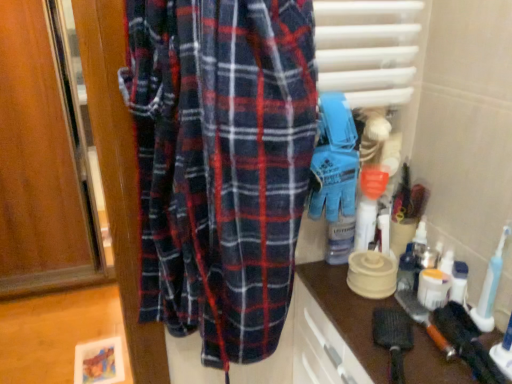
Locate an element on the screen. free point above brown matte countertop at lower right (from a real-world perspective) is located at coordinates (406, 318).